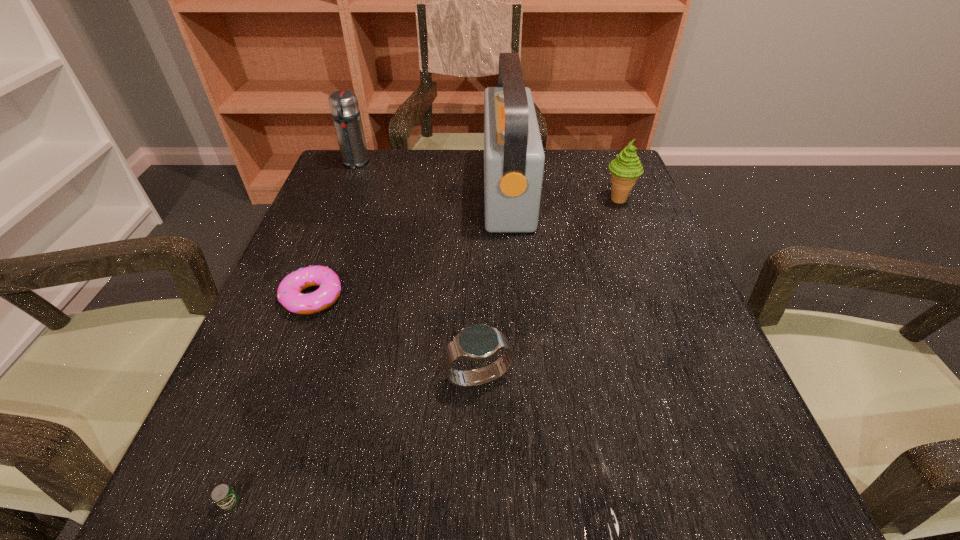
In the image, there is a desktop. At what (x,y) coordinates should I click in order to perform the action: click on blank space at the near edge. Please return your answer as a coordinate pair (x, y). The image size is (960, 540). Looking at the image, I should click on (392, 482).

Identify the location of free space at the left edge of the desktop. (256, 374).

The height and width of the screenshot is (540, 960). In the image, there is a desktop. What are the coordinates of `free space at the right edge` in the screenshot? It's located at (638, 283).

Find the location of a particular element. Image resolution: width=960 pixels, height=540 pixels. blank space at the far left corner of the desktop is located at coordinates (372, 195).

Identify the location of vacant point at the near left corner. (284, 490).

This screenshot has width=960, height=540. Find the location of `free space at the far right corner`. free space at the far right corner is located at coordinates (587, 193).

This screenshot has width=960, height=540. I want to click on free spot at the near right corner of the desktop, so click(x=663, y=498).

Locate an element on the screen. free space between the second nearest object and the rightmost object is located at coordinates (548, 288).

Identify the location of free space that is in between the fourth farthest object and the tallest object. (410, 244).

Find the location of `free space that is in between the tallest object and the watch`. free space that is in between the tallest object and the watch is located at coordinates (493, 284).